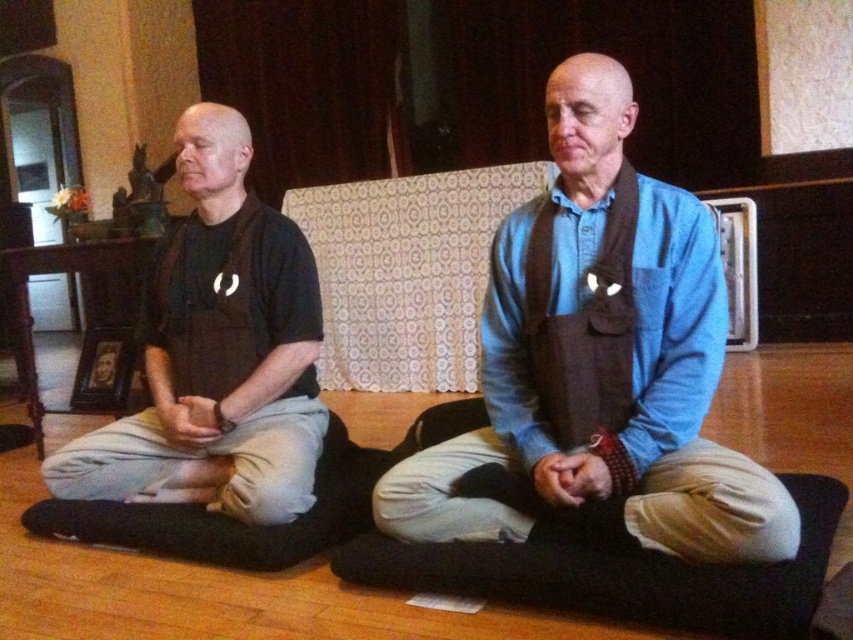
Question: Among these objects, which one is nearest to the camera?

Choices:
 (A) matte black shirt at left
 (B) blue cotton shirt at center

Answer: (B)

Question: In this image, where is blue cotton shirt at center located relative to matte black shirt at left?

Choices:
 (A) right
 (B) left

Answer: (A)

Question: Is blue cotton shirt at center in front of matte black shirt at left?

Choices:
 (A) no
 (B) yes

Answer: (B)

Question: Which object is closer to the camera taking this photo?

Choices:
 (A) blue cotton shirt at center
 (B) matte black shirt at left

Answer: (A)

Question: Observing the image, what is the correct spatial positioning of blue cotton shirt at center in reference to matte black shirt at left?

Choices:
 (A) left
 (B) right

Answer: (B)